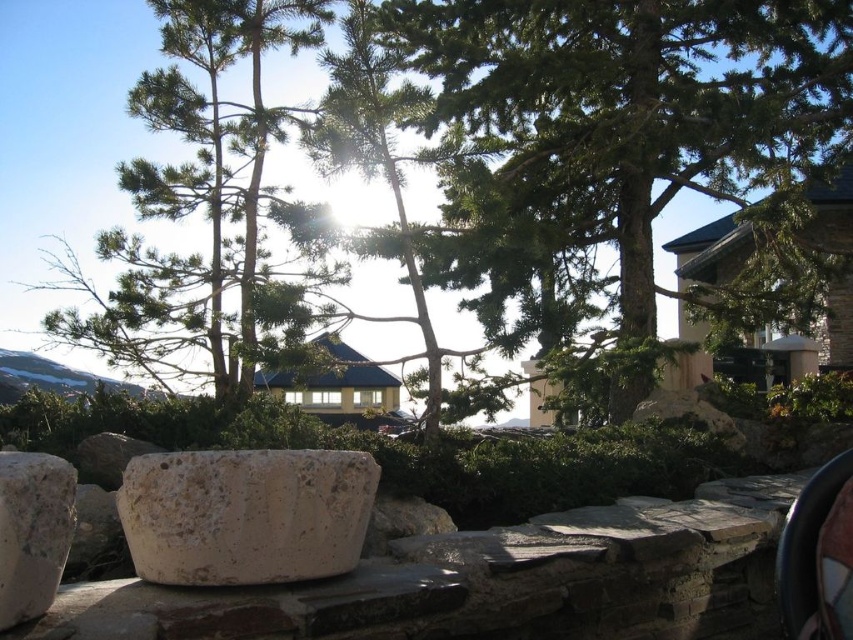
How distant is green textured tree at center from granite boulder at lower left?

green textured tree at center and granite boulder at lower left are 4.00 meters apart.

Who is more distant from viewer, [572,68] or [0,557]?

The point [572,68] is more distant.

Who is more distant from viewer, [587,0] or [73,529]?

Positioned behind is point [587,0].

Where is `green textured tree at center`? The image size is (853, 640). green textured tree at center is located at coordinates (616, 120).

Does green textured tree at center appear on the right side of green leafy tree at upper left?

Yes, green textured tree at center is to the right of green leafy tree at upper left.

You are a GUI agent. You are given a task and a screenshot of the screen. Output one action in this format:
    pyautogui.click(x=<x>, y=<y>)
    Task: Click on the green textured tree at center
    The height and width of the screenshot is (640, 853).
    Given the screenshot: What is the action you would take?
    pyautogui.click(x=616, y=120)

Can you confirm if green leafy tree at upper left is thinner than granite boulder at lower left?

No.

The width and height of the screenshot is (853, 640). What do you see at coordinates (202, 208) in the screenshot?
I see `green leafy tree at upper left` at bounding box center [202, 208].

Is point (241, 262) in front of point (4, 467)?

No, (241, 262) is further to viewer.

Locate an element on the screen. The image size is (853, 640). green leafy tree at upper left is located at coordinates (202, 208).